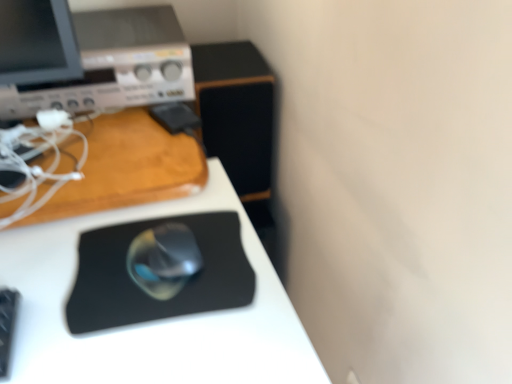
Identify the location of blank space situated above black rubber mousepad at center (from a real-world perspective). (156, 260).